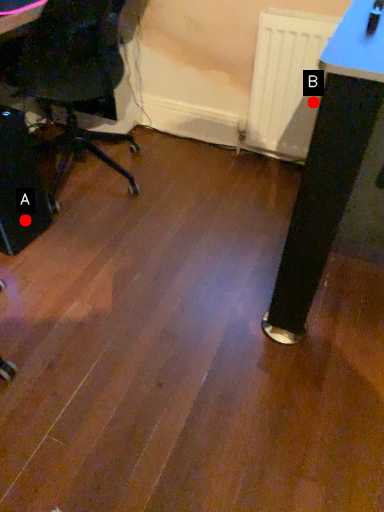
Question: Two points are circled on the image, labeled by A and B beside each circle. Among these points, which one is farthest from the camera?

Choices:
 (A) A is further
 (B) B is further

Answer: (B)